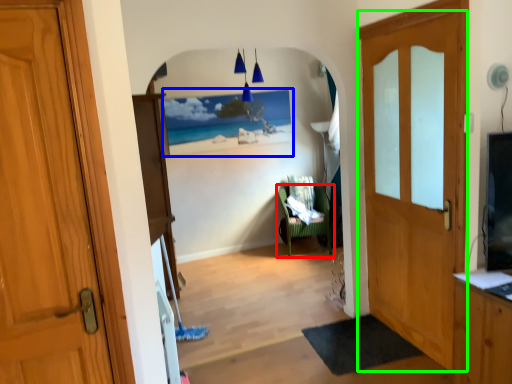
Question: Considering the real-world distances, which object is farthest from chair (highlighted by a red box)? picture frame (highlighted by a blue box) or door (highlighted by a green box)?

Choices:
 (A) picture frame
 (B) door

Answer: (B)